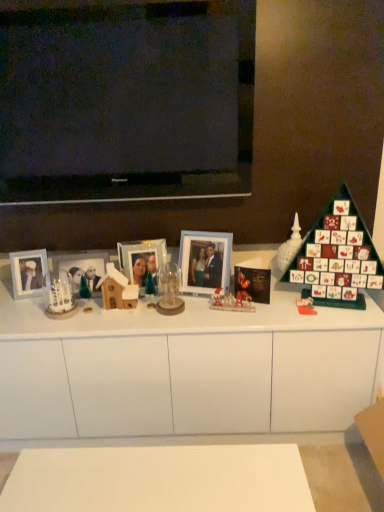
I want to click on free location in front of green matte advent calendar at right, so click(339, 315).